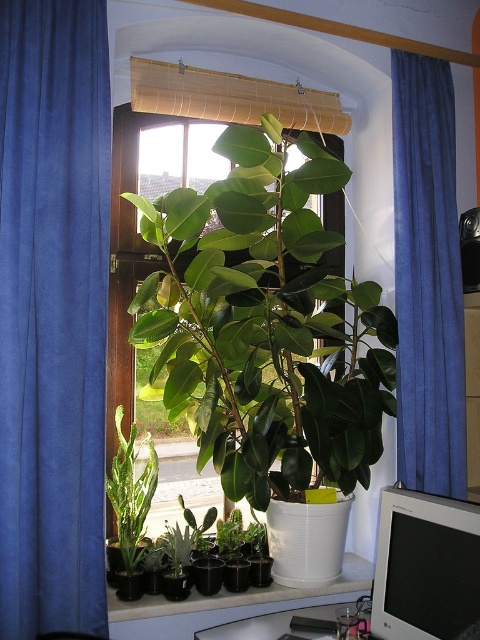
Question: Which object appears closest to the camera in this image?

Choices:
 (A) matte white table at lower right
 (B) green matte cactus at lower left
 (C) transparent glass window at center

Answer: (A)

Question: Is blue velvet curtain at left positioned at the back of green matte cactus at lower left?

Choices:
 (A) yes
 (B) no

Answer: (B)

Question: Does matte white table at lower right appear on the right side of green matte cactus at lower left?

Choices:
 (A) yes
 (B) no

Answer: (A)

Question: Among these points, which one is farthest from the camera?

Choices:
 (A) (196, 541)
 (B) (431, 560)

Answer: (A)

Question: Observing the image, what is the correct spatial positioning of white plastic monitor at center right in reference to transparent glass window at center?

Choices:
 (A) below
 (B) above

Answer: (A)

Question: Which point is farther from the camera taking this photo?

Choices:
 (A) (207, 548)
 (B) (68, 502)

Answer: (A)